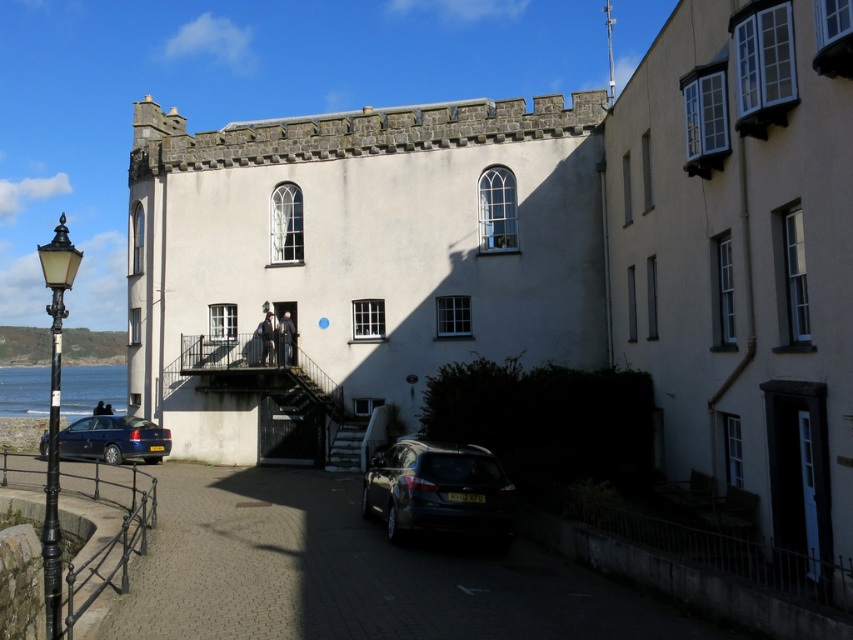
You are a delivery driver who needs to park your vehicle between the shiny black car at lower center and the metallic blue hatchback at lower left. The parking space between them is 30 feet long. Can you safely park your vehicle there?

The distance between the shiny black car at lower center and the metallic blue hatchback at lower left is 28.72 feet, which is shorter than the required 30 feet. Therefore, you cannot safely park your vehicle in that space.

You are a pedestrian standing on the sidewalk in front of the historic building. You want to cross the street to reach the waterfront. There are two cars parked nearby, a shiny black car at lower center and a metallic blue hatchback at lower left. Which car is closer to you, the pedestrian, so you can safely walk around it first?

The shiny black car at lower center is closer to you since it is further to the viewer than the metallic blue hatchback at lower left, meaning it is positioned nearer to your location as a pedestrian.

You are standing in front of the historic building and want to take a photo of both the point at coordinates point (33, 376) and the point at coordinates point (352, 424). Which point should you focus on first to ensure both are in sharp focus?

You should focus on the point (33, 376) first because it is closer to you than the point (352, 424). This ensures that both points will be in focus as the closer point determines the focal plane.